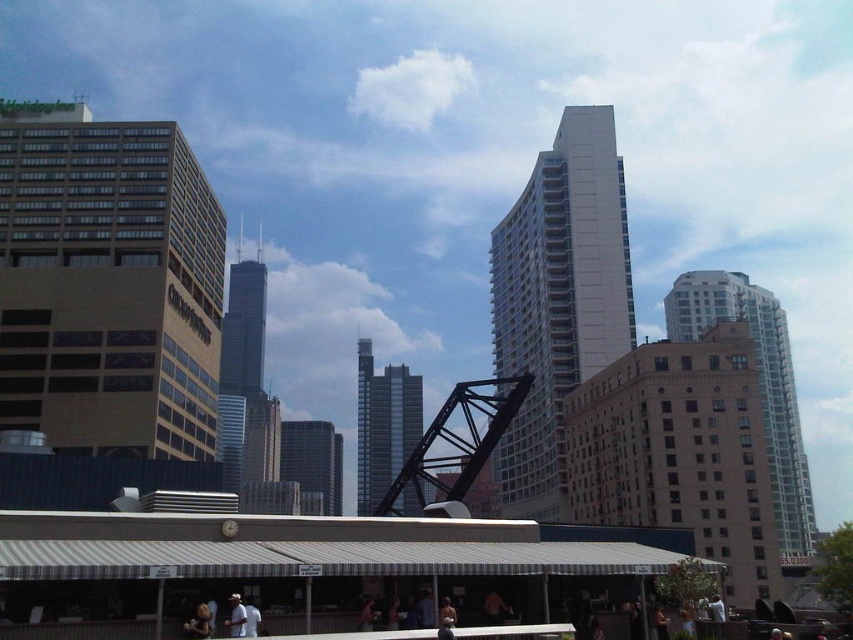
You are an architect analyzing the urban layout. You notice the smooth glass skyscraper at center and the brown leather jacket at center. Which object is positioned lower in the scene?

The smooth glass skyscraper at center is positioned lower than the brown leather jacket at center in the scene.

You are an architect analyzing the urban layout. You observe the glassy steel skyscraper at center and the smooth glass skyscraper at center. Which one is located to the right when viewed from the street level?

The glassy steel skyscraper at center is positioned on the right side of the smooth glass skyscraper at center, so when viewed from the street level, the glassy steel skyscraper at center is located to the right of the smooth glass skyscraper at center.

You are a photographer positioned in the urban scene described. You want to capture a photo that includes both the smooth glass skyscraper at center and the brown leather jacket at center. Which object should you adjust your camera focus on first to ensure it appears closer in the final image?

The smooth glass skyscraper at center is closer to the viewer than the brown leather jacket at center, so you should focus on the smooth glass skyscraper at center first to ensure it appears closer in the final image.